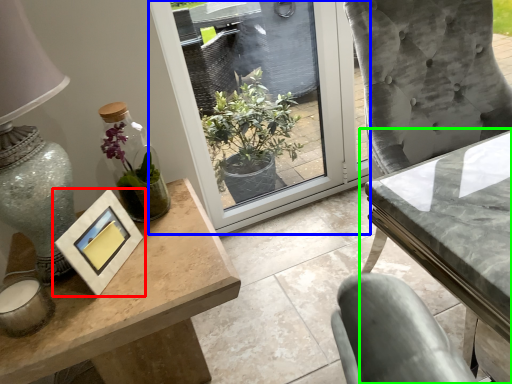
Question: Considering the real-world distances, which object is closest to picture frame (highlighted by a red box)? window (highlighted by a blue box) or table (highlighted by a green box).

Choices:
 (A) window
 (B) table

Answer: (B)